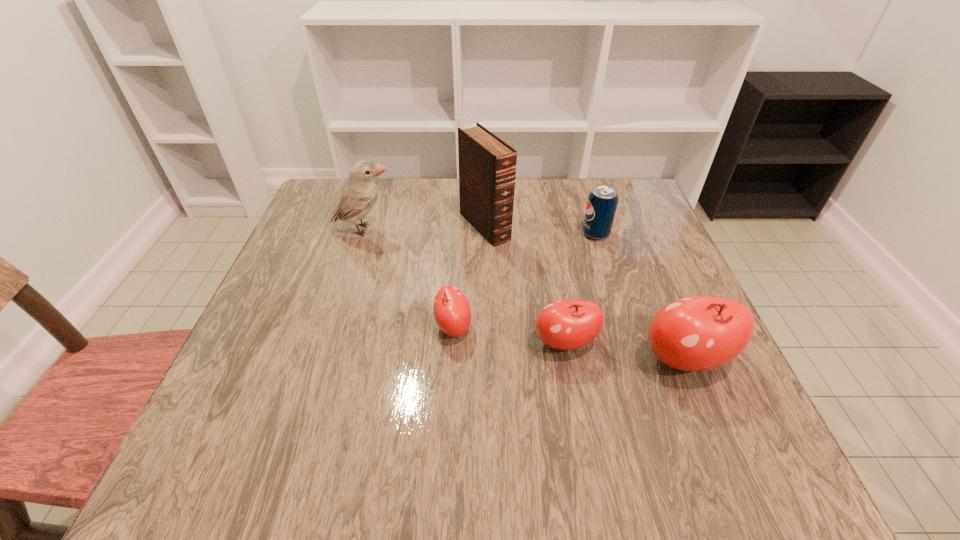
Locate an element on the screen. object that stands as the fourth closest to the soda can is located at coordinates (452, 312).

Select which object appears as the third closest to the soda can. Please provide its 2D coordinates. Your answer should be formatted as a tuple, i.e. [(x, y)], where the tuple contains the x and y coordinates of a point satisfying the conditions above.

[(696, 333)]

Image resolution: width=960 pixels, height=540 pixels. I want to click on apple that can be found as the closest to the second shortest apple, so click(x=696, y=333).

Identify the location of apple that stands as the closest to the soda can. (567, 324).

What are the coordinates of `vacant space that satisfies the following two spatial constraints: 1. at the face of the leftmost object; 2. on the left side of the shortest apple` in the screenshot? It's located at (333, 327).

Where is `free space that satisfies the following two spatial constraints: 1. on the back side of the leftmost apple; 2. at the face of the leftmost object`? free space that satisfies the following two spatial constraints: 1. on the back side of the leftmost apple; 2. at the face of the leftmost object is located at coordinates (459, 230).

Image resolution: width=960 pixels, height=540 pixels. In order to click on free spot that satisfies the following two spatial constraints: 1. on the front side of the second tallest apple; 2. on the right side of the rightmost apple in this screenshot , I will do point(568,360).

The image size is (960, 540). What are the coordinates of `free spot that satisfies the following two spatial constraints: 1. on the front side of the tallest object; 2. at the face of the bird` in the screenshot? It's located at (485, 230).

Locate an element on the screen. Image resolution: width=960 pixels, height=540 pixels. vacant space that satisfies the following two spatial constraints: 1. at the face of the bird; 2. on the right side of the leftmost apple is located at coordinates (333, 327).

Identify the location of free spot that satisfies the following two spatial constraints: 1. at the face of the second apple from right to left; 2. on the right side of the bird. (328, 343).